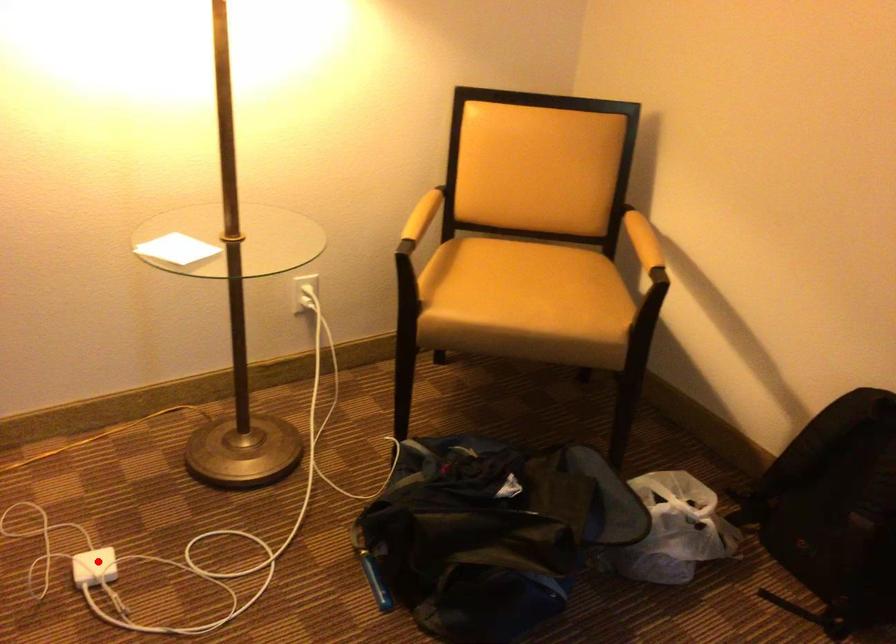
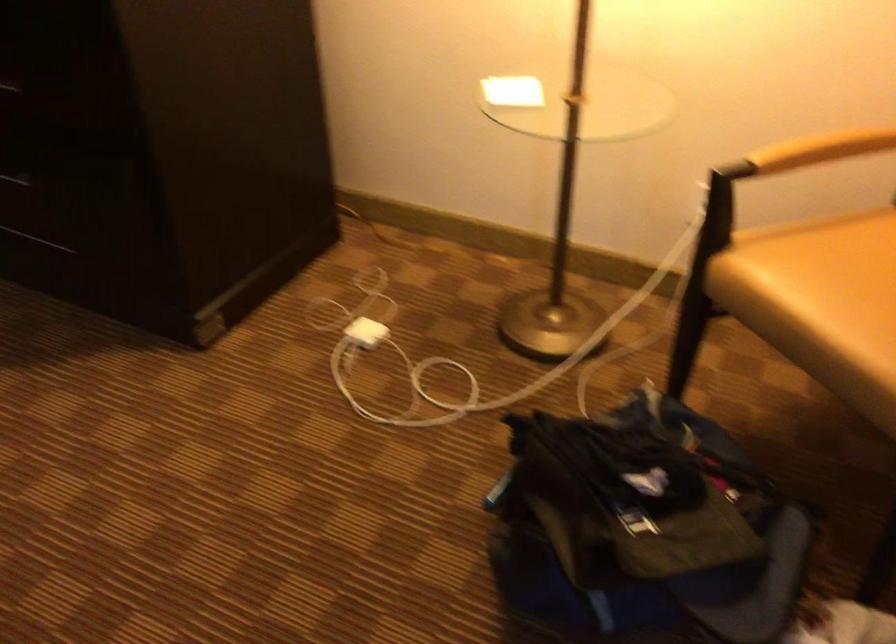
In the second image, find the point that corresponds to the highlighted location in the first image.

(366, 332)